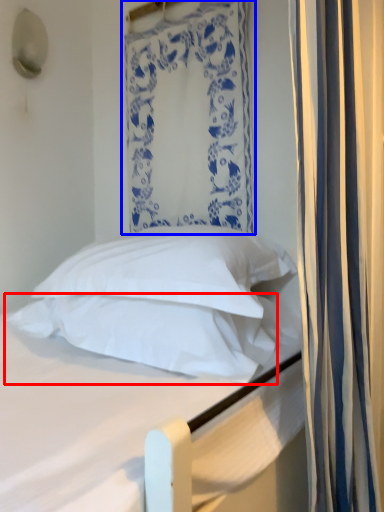
Question: Which of the following is the farthest to the observer, pillow (highlighted by a red box) or curtain (highlighted by a blue box)?

Choices:
 (A) pillow
 (B) curtain

Answer: (B)